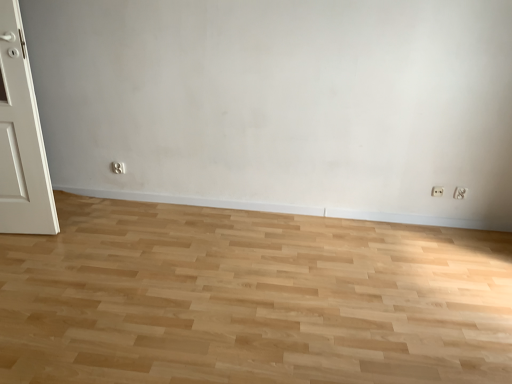
Question: Is white plastic electric outlet at lower right, acting as the first electric outlet starting from the left, at the left side of natural wood floor at center?

Choices:
 (A) yes
 (B) no

Answer: (B)

Question: Is white plastic electric outlet at lower right, acting as the first electric outlet starting from the left, to the right of natural wood floor at center from the viewer's perspective?

Choices:
 (A) no
 (B) yes

Answer: (B)

Question: Is white plastic electric outlet at lower right, acting as the first electric outlet starting from the left, not within natural wood floor at center?

Choices:
 (A) yes
 (B) no

Answer: (A)

Question: Considering the relative positions of white plastic electric outlet at lower right, acting as the first electric outlet starting from the left, and natural wood floor at center in the image provided, is white plastic electric outlet at lower right, acting as the first electric outlet starting from the left, in front of natural wood floor at center?

Choices:
 (A) yes
 (B) no

Answer: (B)

Question: Does white plastic electric outlet at lower right, acting as the first electric outlet starting from the left, have a larger size compared to natural wood floor at center?

Choices:
 (A) yes
 (B) no

Answer: (B)

Question: Which is correct: white plastic electric outlet at lower right, which ranks as the second electric outlet in left-to-right order, is inside white plastic electric outlet at lower right, acting as the first electric outlet starting from the left, or outside of it?

Choices:
 (A) inside
 (B) outside

Answer: (B)

Question: Would you say white plastic electric outlet at lower right, positioned as the first electric outlet in right-to-left order, is to the left or to the right of white plastic electric outlet at lower right, acting as the first electric outlet starting from the left, in the picture?

Choices:
 (A) left
 (B) right

Answer: (B)

Question: Is white plastic electric outlet at lower right, positioned as the first electric outlet in right-to-left order, wider or thinner than white plastic electric outlet at lower right, acting as the first electric outlet starting from the left?

Choices:
 (A) wide
 (B) thin

Answer: (A)

Question: From the image's perspective, is white plastic electric outlet at lower right, positioned as the first electric outlet in right-to-left order, above or below white plastic electric outlet at lower right, acting as the first electric outlet starting from the left?

Choices:
 (A) above
 (B) below

Answer: (B)

Question: Is natural wood floor at center to the left or to the right of white plastic electric outlet at lower right, acting as the first electric outlet starting from the left, in the image?

Choices:
 (A) left
 (B) right

Answer: (A)

Question: Relative to white plastic electric outlet at lower right, acting as the first electric outlet starting from the left, is natural wood floor at center in front or behind?

Choices:
 (A) behind
 (B) front

Answer: (B)

Question: Is natural wood floor at center taller or shorter than white plastic electric outlet at lower right, which is counted as the second electric outlet, starting from the right?

Choices:
 (A) short
 (B) tall

Answer: (A)

Question: From a real-world perspective, relative to white plastic electric outlet at lower right, acting as the first electric outlet starting from the left, is natural wood floor at center vertically above or below?

Choices:
 (A) below
 (B) above

Answer: (A)

Question: Considering their positions, is white plastic electric outlet at lower right, which is counted as the second electric outlet, starting from the right, located in front of or behind white plastic electric outlet at lower right, which ranks as the second electric outlet in left-to-right order?

Choices:
 (A) behind
 (B) front

Answer: (A)

Question: From a real-world perspective, is white plastic electric outlet at lower right, which is counted as the second electric outlet, starting from the right, positioned above or below white plastic electric outlet at lower right, positioned as the first electric outlet in right-to-left order?

Choices:
 (A) above
 (B) below

Answer: (B)